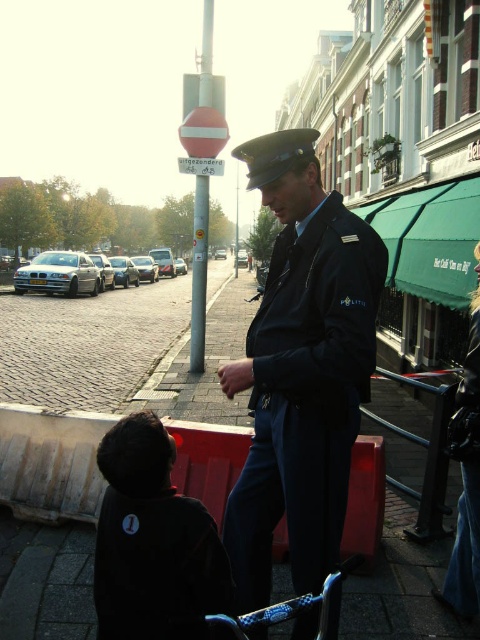
Looking at this image, which of these two, cobblestone pavement at lower left or dark blue fabric uniform at center, stands taller?

cobblestone pavement at lower left

Between point (146, 339) and point (472, 340), which one is positioned in front?

Point (472, 340)

Identify the location of cobblestone pavement at lower left. (88, 344).

Does point (168, 532) come behind point (64, 408)?

No, (168, 532) is closer to viewer.

Who is higher up, black matte jacket at lower left or cobblestone pavement at lower left?

cobblestone pavement at lower left is above.

Locate an element on the screen. The width and height of the screenshot is (480, 640). black matte jacket at lower left is located at coordinates (154, 544).

Is black matte jacket at lower left thinner than dark blue fabric uniform at center?

No.

Based on the photo, who is more forward, (x=126, y=420) or (x=468, y=486)?

Point (x=126, y=420) is in front.

In order to click on black matte jacket at lower left in this screenshot , I will do `click(154, 544)`.